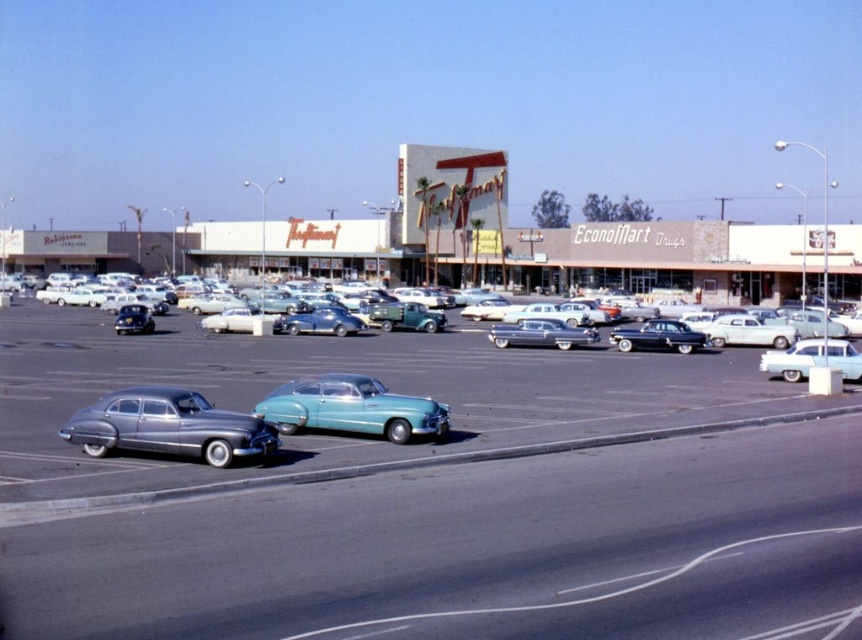
Question: Which object is the closest to the metallic blue sedan at center?

Choices:
 (A) metallic silver sedan at lower left
 (B) shiny silver sedan at center
 (C) teal glossy sedan at center

Answer: (B)

Question: Is teal glossy car at center behind glossy black sedan at center?

Choices:
 (A) yes
 (B) no

Answer: (B)

Question: Does teal glossy car at center appear under beige concrete building at center?

Choices:
 (A) yes
 (B) no

Answer: (A)

Question: From the image, what is the correct spatial relationship of teal glossy sedan at center in relation to shiny black sedan at center-left?

Choices:
 (A) below
 (B) above

Answer: (A)

Question: Based on their relative distances, which object is nearer to the metallic blue sedan at center?

Choices:
 (A) shiny black sedan at center-left
 (B) glossy black sedan at center
 (C) white glossy sedan at center-right

Answer: (B)

Question: Which point is farther to the camera?

Choices:
 (A) metallic blue sedan at center
 (B) shiny black sedan at center-left
 (C) teal glossy sedan at center
 (D) beige concrete building at center

Answer: (D)